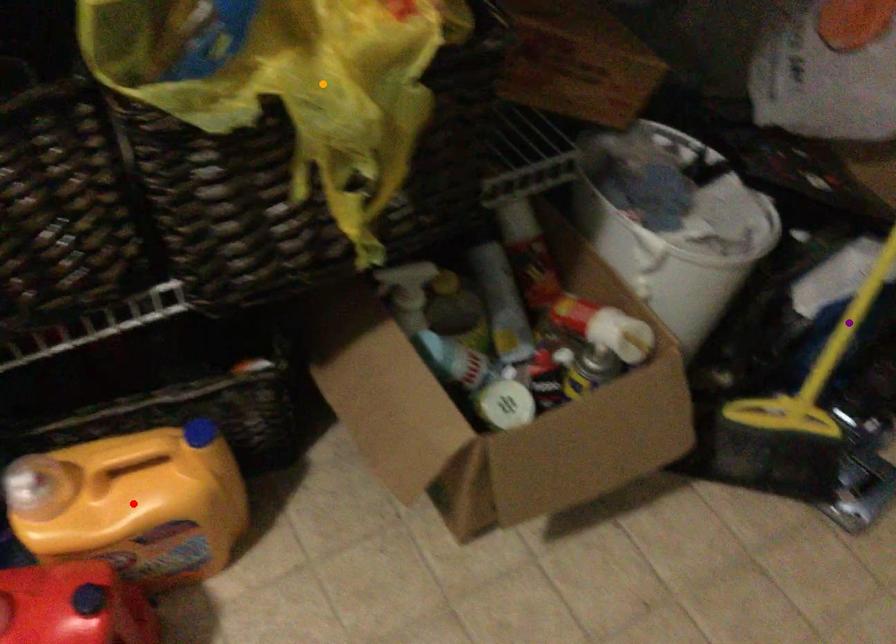
Order these from nearest to farthest:
orange point
red point
purple point

purple point, red point, orange point